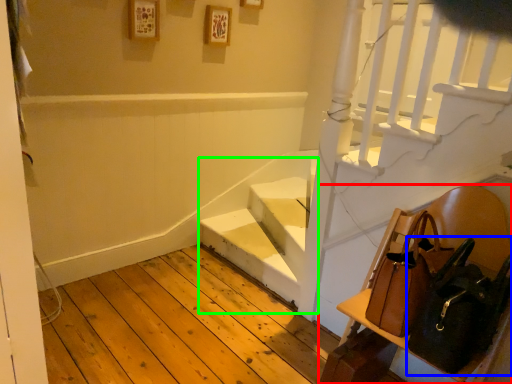
Question: Which object is positioned farthest from furniture (highlighted by a red box)? Select from shoulder bag (highlighted by a blue box) and stairwell (highlighted by a green box).

Choices:
 (A) shoulder bag
 (B) stairwell

Answer: (B)